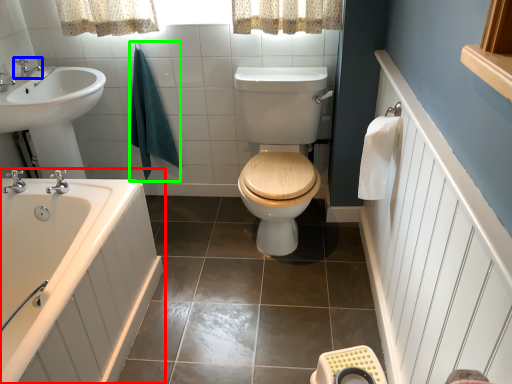
Question: Which object is positioned farthest from bathtub (highlighted by a red box)? Select from tap (highlighted by a blue box) and bath towel (highlighted by a green box).

Choices:
 (A) tap
 (B) bath towel

Answer: (A)